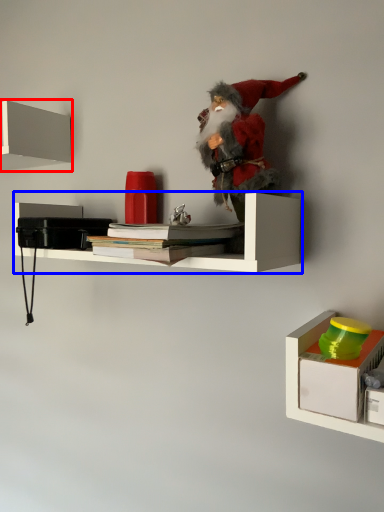
Question: Which point is closer to the camera, shelf (highlighted by a red box) or shelf (highlighted by a blue box)?

Choices:
 (A) shelf
 (B) shelf

Answer: (B)